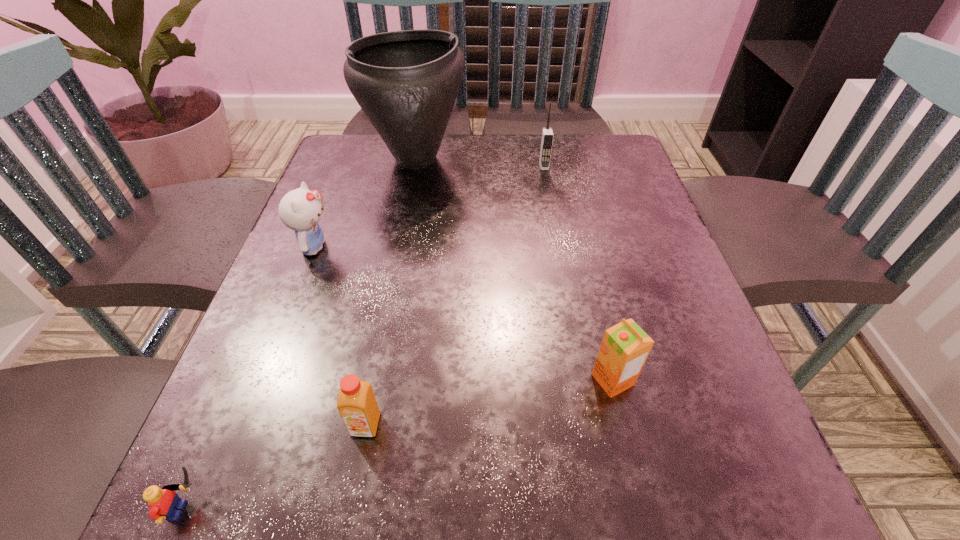
The height and width of the screenshot is (540, 960). What are the coordinates of `urn` in the screenshot? It's located at (406, 82).

At what (x,y) coordinates should I click in order to perform the action: click on the fifth object from left to right. Please return your answer as a coordinate pair (x, y). The width and height of the screenshot is (960, 540). Looking at the image, I should click on (547, 134).

I want to click on kitten, so click(300, 210).

Locate an element on the screen. the rightmost object is located at coordinates (625, 347).

You are a GUI agent. You are given a task and a screenshot of the screen. Output one action in this format:
    pyautogui.click(x=<x>, y=<y>)
    Task: Click on the right orange juice
    
    Given the screenshot: What is the action you would take?
    (x=625, y=347)

Where is `the fifth farthest object`? the fifth farthest object is located at coordinates (357, 405).

Image resolution: width=960 pixels, height=540 pixels. Find the location of `the left orange juice`. the left orange juice is located at coordinates (357, 405).

Find the location of a particular element. This screenshot has width=960, height=540. the nearest object is located at coordinates (164, 503).

The height and width of the screenshot is (540, 960). In order to click on the shortest object in this screenshot , I will do `click(164, 503)`.

I want to click on free space located on the front of the tallest object, so click(392, 285).